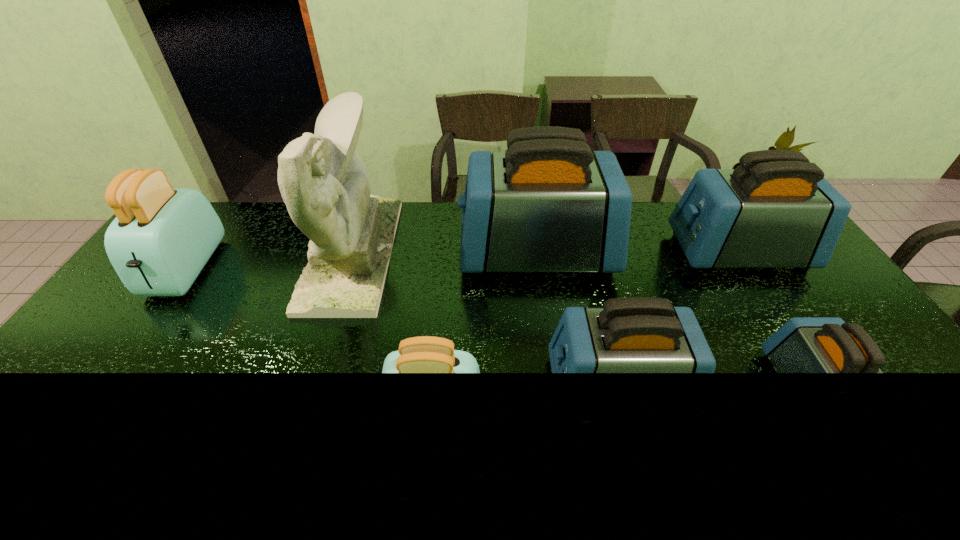
This screenshot has height=540, width=960. Find the location of `free space at the right edge of the desktop`. free space at the right edge of the desktop is located at coordinates (880, 407).

The height and width of the screenshot is (540, 960). Find the location of `free space between the bigger light toaster and the shortest object`. free space between the bigger light toaster and the shortest object is located at coordinates (497, 330).

The width and height of the screenshot is (960, 540). I want to click on vacant area that lies between the smaller light toaster and the shortest object, so click(x=622, y=402).

At what (x,y) coordinates should I click in order to perform the action: click on unoccupied area between the third biggest blue toaster and the bigger light toaster. Please return your answer as a coordinate pair (x, y). The height and width of the screenshot is (540, 960). Looking at the image, I should click on (401, 327).

You are a GUI agent. You are given a task and a screenshot of the screen. Output one action in this format:
    pyautogui.click(x=<x>, y=<y>)
    Task: Click on the free space between the shortest object and the right light toaster
    
    Given the screenshot: What is the action you would take?
    pyautogui.click(x=622, y=402)

Choose which object is the nearest neighbor to the sixth object from right to left. Please provide its 2D coordinates. Your answer should be formatted as a tuple, i.e. [(x, y)], where the tuple contains the x and y coordinates of a point satisfying the conditions above.

[(547, 204)]

Identify the location of object that is the closest to the second smallest blue toaster. The width and height of the screenshot is (960, 540). (425, 354).

In order to click on toaster that stands as the fifth closest to the smallest blue toaster in this screenshot , I will do `click(162, 237)`.

This screenshot has width=960, height=540. What are the coordinates of `toaster that is the fifth nearest to the right light toaster` in the screenshot? It's located at (775, 210).

Locate which blue toaster ranks fourth in proximity to the nearer light toaster. Please provide its 2D coordinates. Your answer should be formatted as a tuple, i.e. [(x, y)], where the tuple contains the x and y coordinates of a point satisfying the conditions above.

[(775, 210)]